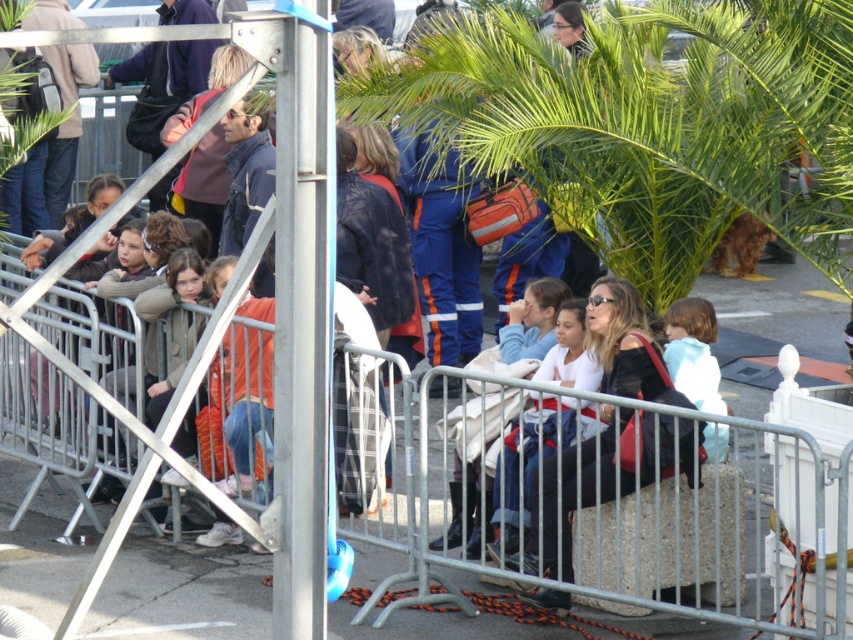
Question: Does silver metallic pole at center lie behind matte black jacket at center?

Choices:
 (A) no
 (B) yes

Answer: (A)

Question: Which point appears farthest from the camera in this image?

Choices:
 (A) (610, 420)
 (B) (453, 545)
 (C) (300, 620)
 (D) (704, 352)

Answer: (B)

Question: Is silver metallic pole at center smaller than light blue denim jacket at center?

Choices:
 (A) no
 (B) yes

Answer: (A)

Question: Can you confirm if matte black jacket at center is thinner than light blue fabric at center?

Choices:
 (A) no
 (B) yes

Answer: (A)

Question: Which of the following is the farthest from the observer?

Choices:
 (A) matte black jacket at center
 (B) silver metallic pole at center
 (C) light blue denim jacket at center

Answer: (C)

Question: Among these objects, which one is farthest from the camera?

Choices:
 (A) silver metallic pole at center
 (B) light blue denim jacket at center
 (C) light blue fabric at center
 (D) matte black jacket at center

Answer: (B)